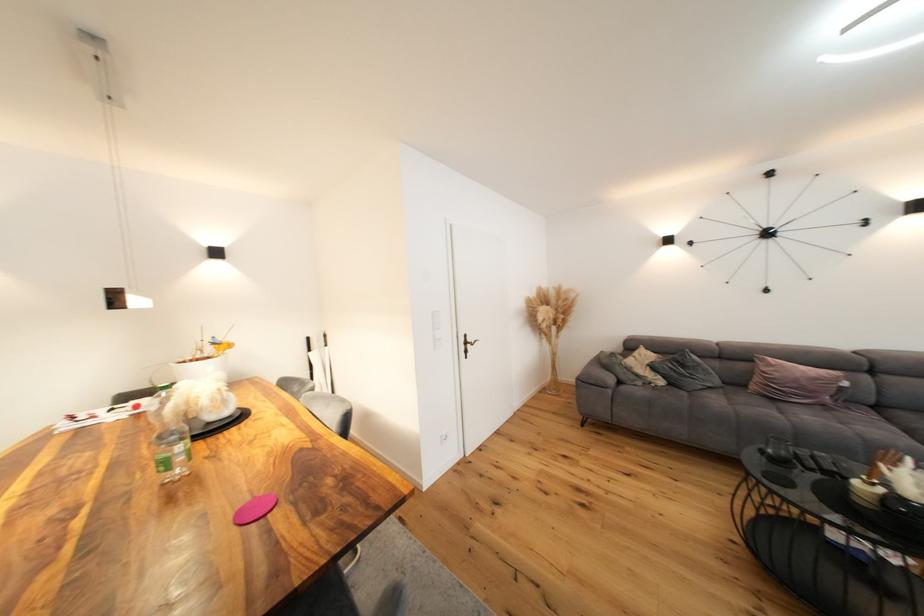
Which object does [172,453] point to?

It corresponds to the plastic water bottle in the image.